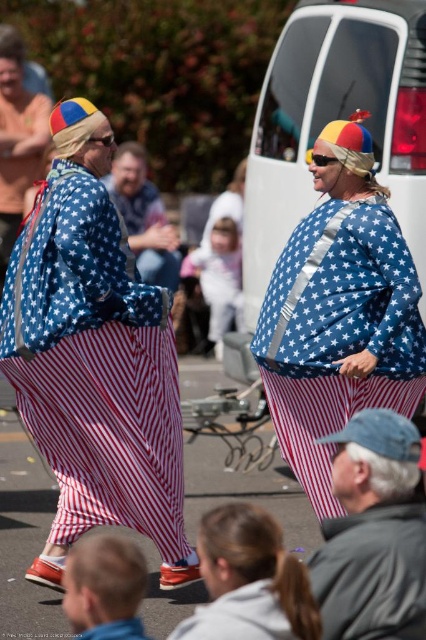
Question: Which point is farther to the camera?

Choices:
 (A) (294, 628)
 (B) (123, 550)
 (C) (376, 515)

Answer: (C)

Question: Is the position of gray fabric jacket at lower right more distant than that of blonde hair at lower left?

Choices:
 (A) yes
 (B) no

Answer: (A)

Question: Where is gray fabric jacket at lower right located in relation to blue denim jeans at center in the image?

Choices:
 (A) right
 (B) left

Answer: (A)

Question: Observing the image, what is the correct spatial positioning of matte fabric dress at center in reference to matte blue star-patterned shirt at center?

Choices:
 (A) right
 (B) left

Answer: (B)

Question: Which of the following is the closest to the observer?

Choices:
 (A) (330, 332)
 (B) (158, 289)
 (C) (213, 529)
 (D) (89, 570)

Answer: (D)

Question: Among these points, which one is nearest to the camera?

Choices:
 (A) (411, 280)
 (B) (28, 579)
 (C) (131, 620)

Answer: (C)